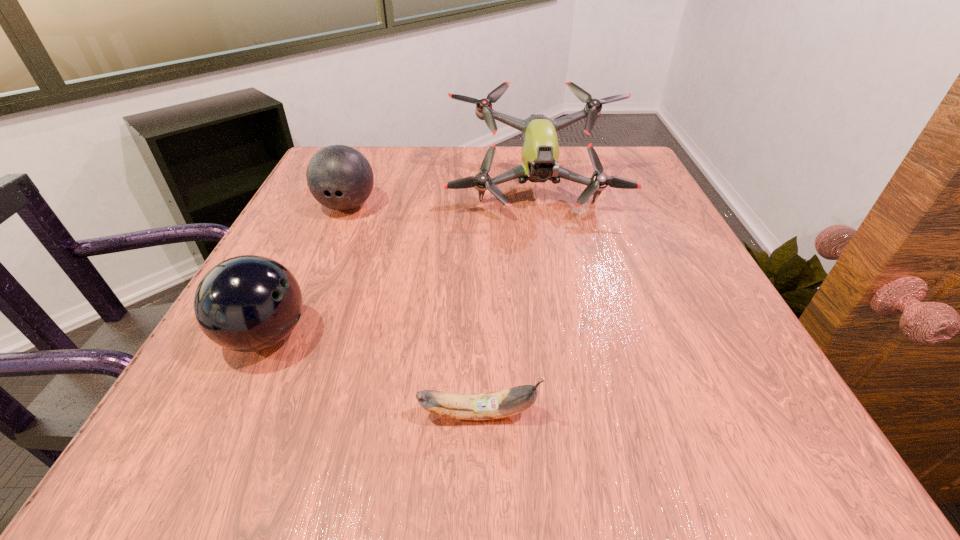
Find the location of a particular element. vacant area that lies between the drone and the shortest object is located at coordinates (x=507, y=303).

Locate an element on the screen. Image resolution: width=960 pixels, height=540 pixels. free space between the nearest object and the tallest object is located at coordinates (507, 303).

Locate an element on the screen. This screenshot has width=960, height=540. object that stands as the closest to the banana is located at coordinates (248, 303).

Locate an element on the screen. Image resolution: width=960 pixels, height=540 pixels. object that is the third closest to the banana is located at coordinates (339, 177).

Where is `vacant space that satisfies the following two spatial constraints: 1. on the front-facing side of the drone; 2. on the peel of the banana`? The width and height of the screenshot is (960, 540). vacant space that satisfies the following two spatial constraints: 1. on the front-facing side of the drone; 2. on the peel of the banana is located at coordinates (577, 414).

The height and width of the screenshot is (540, 960). What are the coordinates of `blank area in the image that satisfies the following two spatial constraints: 1. on the front-facing side of the drone; 2. on the side of the nearer bowling ball with the finger holes` in the screenshot? It's located at (563, 336).

Locate an element on the screen. The image size is (960, 540). free spot that satisfies the following two spatial constraints: 1. on the front-facing side of the tallest object; 2. on the peel of the shortest object is located at coordinates (577, 414).

At what (x,y) coordinates should I click in order to perform the action: click on vacant region that satisfies the following two spatial constraints: 1. on the grip area of the farther bowling ball; 2. on the side of the second nearest object with the finger holes. Please return your answer as a coordinate pair (x, y). This screenshot has width=960, height=540. Looking at the image, I should click on (292, 336).

This screenshot has width=960, height=540. I want to click on free space in the image that satisfies the following two spatial constraints: 1. on the front-facing side of the drone; 2. on the peel of the nearest object, so click(x=577, y=414).